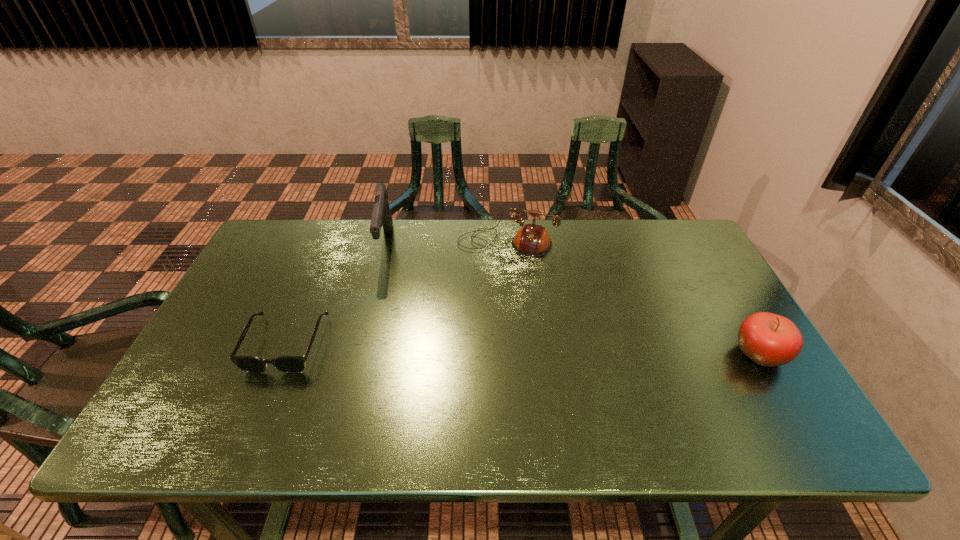
You are a GUI agent. You are given a task and a screenshot of the screen. Output one action in this format:
    pyautogui.click(x=<x>, y=<y>)
    Task: Click on the vacant space located 0.160m on the rotary dial of the third object from left to right
    
    Given the screenshot: What is the action you would take?
    pyautogui.click(x=479, y=296)

Identify the location of vacant space located 0.280m at the muzzle of the gun. The image size is (960, 540). (442, 317).

Locate an element on the screen. free point located at the muzzle of the gun is located at coordinates (468, 341).

This screenshot has height=540, width=960. In order to click on free region located 0.400m at the muzzle of the gun in this screenshot , I will do `click(470, 343)`.

Locate an element on the screen. The width and height of the screenshot is (960, 540). telephone at the far edge is located at coordinates (533, 240).

The image size is (960, 540). Find the location of `gun that is positioned at the far edge`. gun that is positioned at the far edge is located at coordinates (381, 216).

This screenshot has height=540, width=960. What are the coordinates of `object that is at the near edge` in the screenshot? It's located at (768, 339).

This screenshot has width=960, height=540. Identify the location of object located in the left edge section of the desktop. (288, 364).

Identify the location of object situated at the right edge. (768, 339).

Image resolution: width=960 pixels, height=540 pixels. I want to click on object located at the near right corner, so click(768, 339).